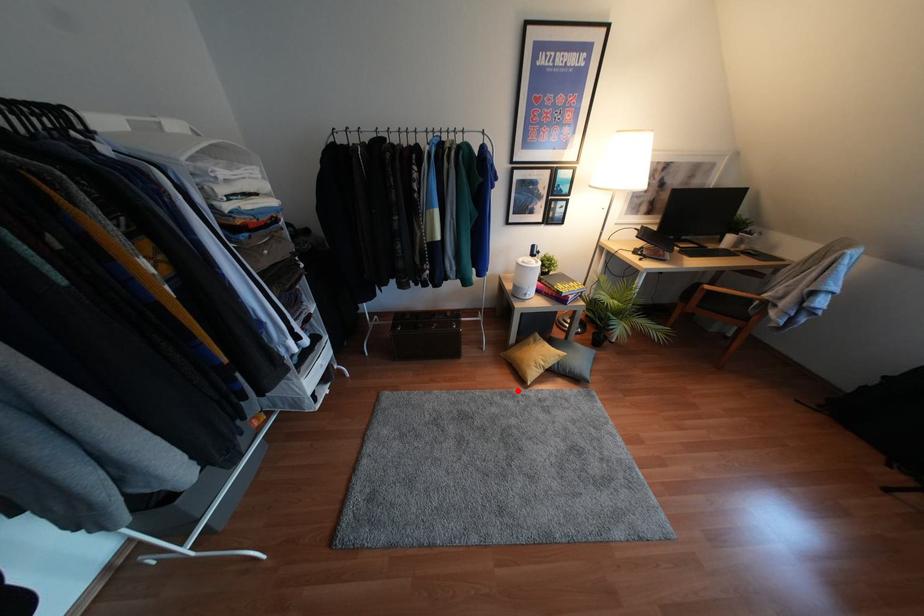
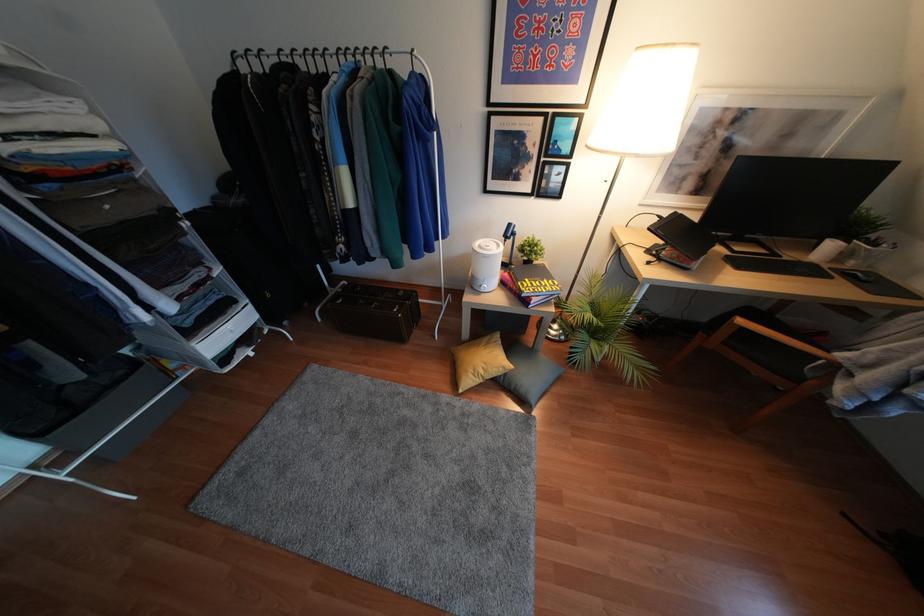
The point at the highlighted location is marked in the first image. Where is the corresponding point in the second image?

(445, 397)